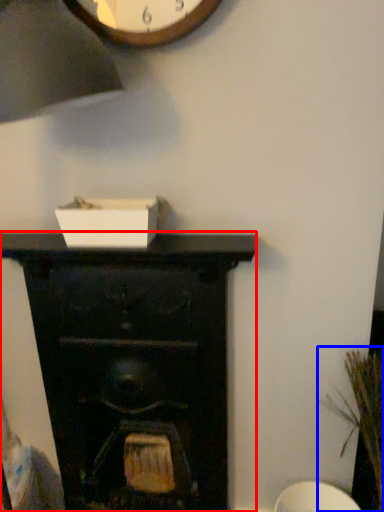
Question: Which of the following is the farthest to the observer, fireplace (highlighted by a red box) or plant (highlighted by a blue box)?

Choices:
 (A) fireplace
 (B) plant

Answer: (A)